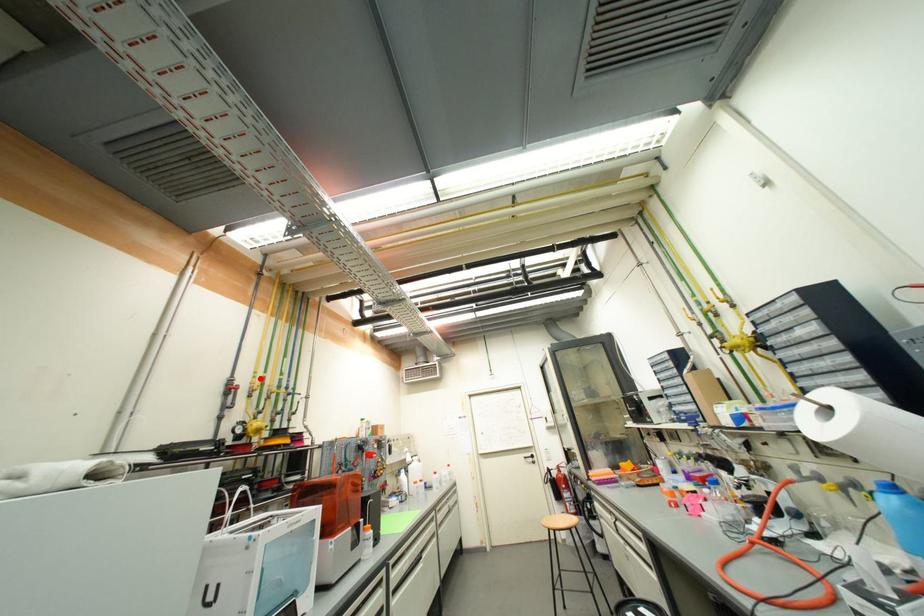
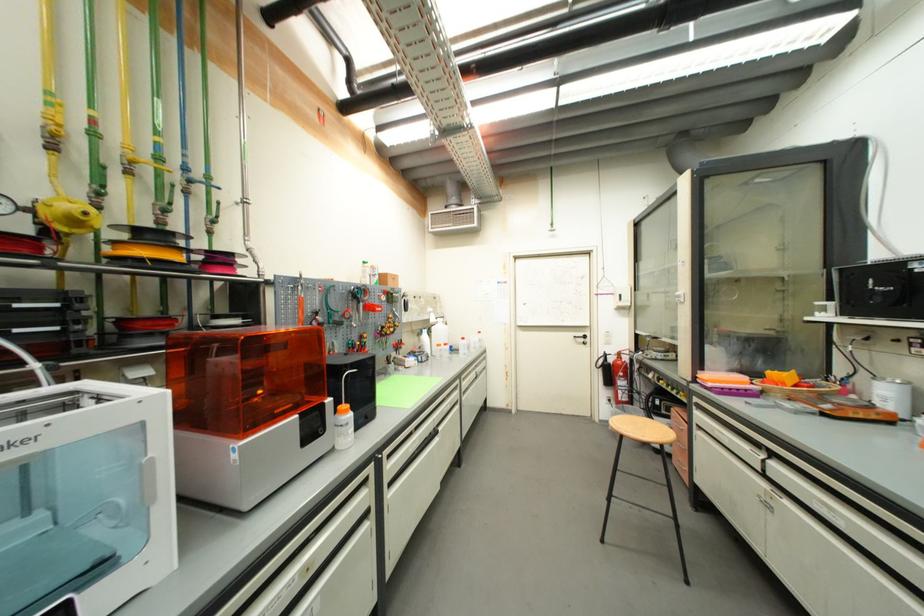
In the second image, find the point that corresponds to the highlighted location in the first image.

(55, 106)